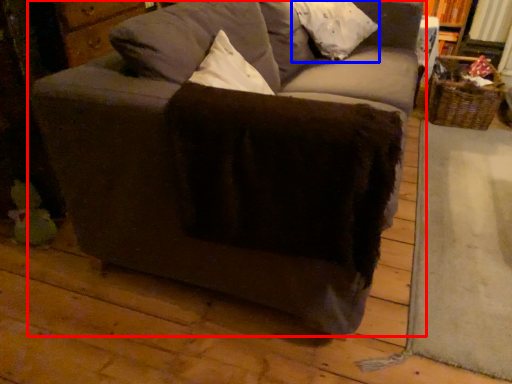
Question: Which object is further to the camera taking this photo, studio couch (highlighted by a red box) or pillow (highlighted by a blue box)?

Choices:
 (A) studio couch
 (B) pillow

Answer: (B)